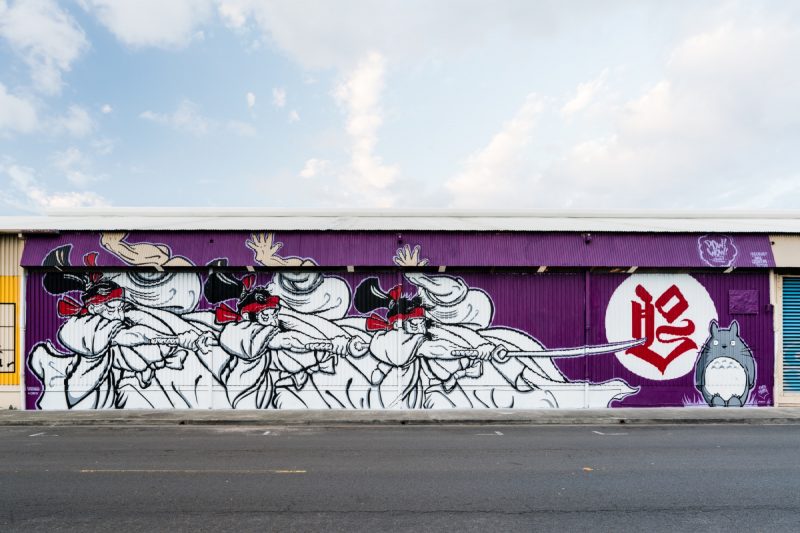
Locate an element on the screen. The image size is (800, 533). mural is located at coordinates (310, 322), (709, 369).